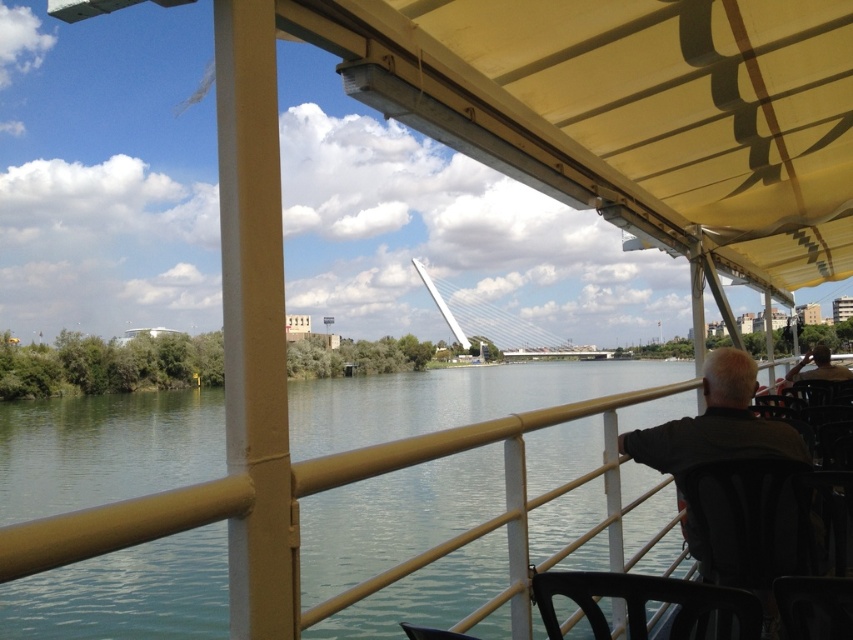
Question: Among these points, which one is nearest to the camera?

Choices:
 (A) (537, 605)
 (B) (666, 468)
 (C) (824, 362)
 (D) (486, 422)

Answer: (A)

Question: In this image, where is dark gray fabric jacket at right located relative to black plastic chair at lower center?

Choices:
 (A) below
 (B) above

Answer: (A)

Question: Is greenish water at center thinner than black leather chair at right?

Choices:
 (A) yes
 (B) no

Answer: (B)

Question: Which object appears farthest from the camera in this image?

Choices:
 (A) black plastic chair at lower center
 (B) black leather chair at right
 (C) greenish water at center

Answer: (B)

Question: Can you confirm if greenish water at center is smaller than black plastic chair at lower center?

Choices:
 (A) yes
 (B) no

Answer: (B)

Question: Which point is closer to the camera taking this photo?

Choices:
 (A) (729, 451)
 (B) (12, 586)

Answer: (A)